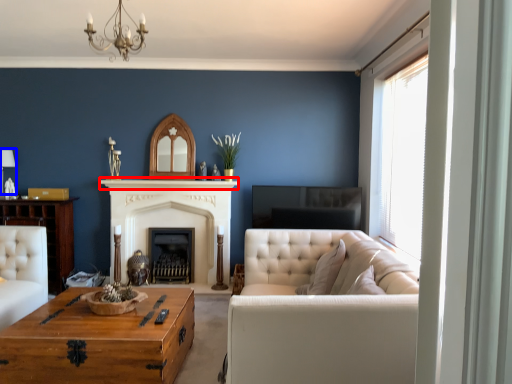
Question: Which object appears farthest to the camera in this image, mantle (highlighted by a red box) or lamp (highlighted by a blue box)?

Choices:
 (A) mantle
 (B) lamp

Answer: (A)